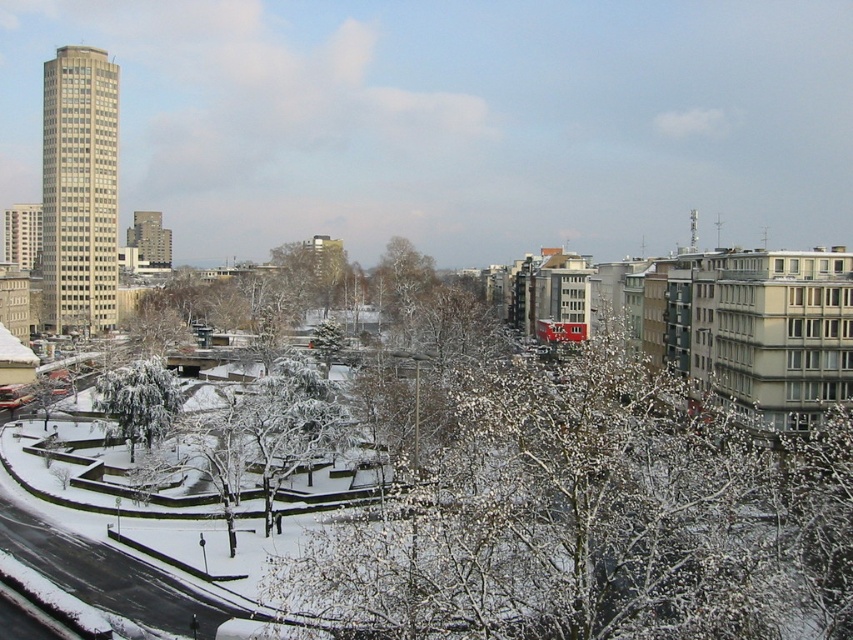
Question: Which of the following is the closest to the observer?

Choices:
 (A) white frosty tree at lower left
 (B) white snow-covered tree at center

Answer: (B)

Question: Is the position of white snow-covered tree at center more distant than that of white frosty tree at lower left?

Choices:
 (A) yes
 (B) no

Answer: (B)

Question: Is white snow-covered tree at center bigger than white frosty tree at lower left?

Choices:
 (A) yes
 (B) no

Answer: (A)

Question: Can you confirm if white snow-covered tree at center is positioned above white frosty tree at lower left?

Choices:
 (A) no
 (B) yes

Answer: (B)